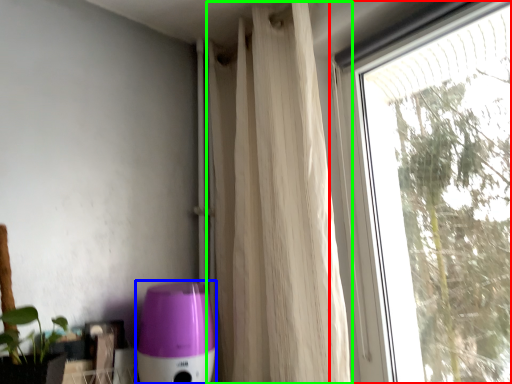
Question: Which object is positioned closest to window (highlighted by a red box)? Select from appliance (highlighted by a blue box) and curtain (highlighted by a green box).

Choices:
 (A) appliance
 (B) curtain

Answer: (B)